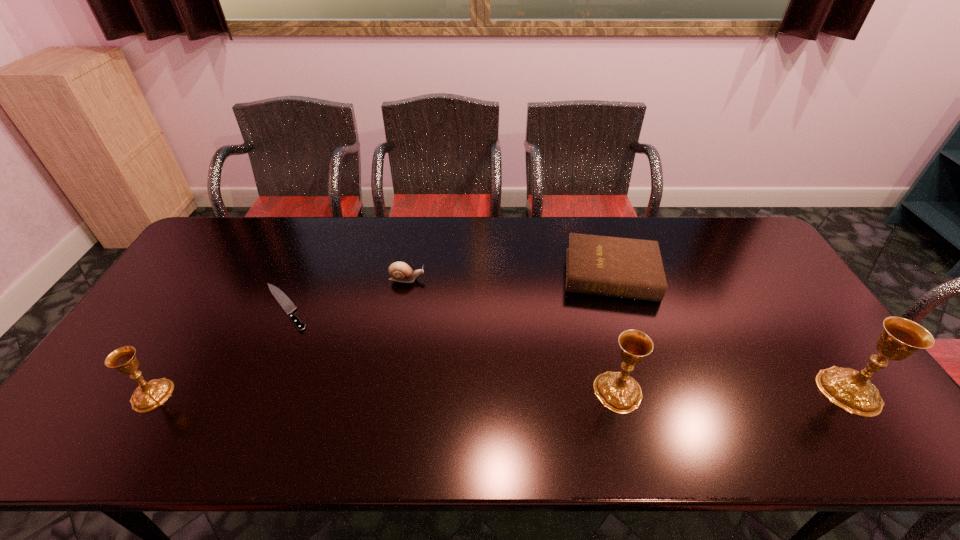
Where is `free spot located on the right of the leftmost object`? free spot located on the right of the leftmost object is located at coordinates (216, 395).

Where is `vacant space located 0.340m on the back of the second chalice from left to right`? vacant space located 0.340m on the back of the second chalice from left to right is located at coordinates (588, 280).

Find the location of a particular element. The image size is (960, 540). free space located on the left of the rightmost chalice is located at coordinates (727, 390).

The image size is (960, 540). In order to click on free space located on the front-facing side of the escargot in this screenshot , I will do tap(527, 279).

Locate an element on the screen. free space located on the back of the shortest object is located at coordinates pyautogui.click(x=316, y=237).

I want to click on vacant space located 0.300m on the front of the Bible, so click(648, 391).

You are a GUI agent. You are given a task and a screenshot of the screen. Output one action in this format:
    pyautogui.click(x=<x>, y=<y>)
    Task: Click on the object that is at the far edge
    
    Given the screenshot: What is the action you would take?
    pyautogui.click(x=629, y=268)

Identify the location of object located in the left edge section of the desktop. (147, 396).

This screenshot has width=960, height=540. What are the coordinates of `object present at the right edge` in the screenshot? It's located at (852, 390).

Identify the location of object situated at the near left corner. (147, 396).